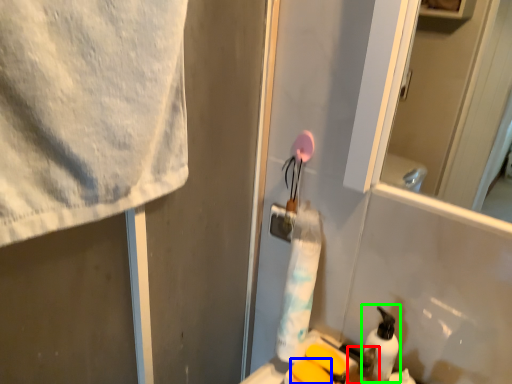
Question: Considering the real-world distances, which object is farthest from toiletry (highlighted by a red box)? soap (highlighted by a blue box) or cleaning product (highlighted by a green box)?

Choices:
 (A) soap
 (B) cleaning product

Answer: (A)